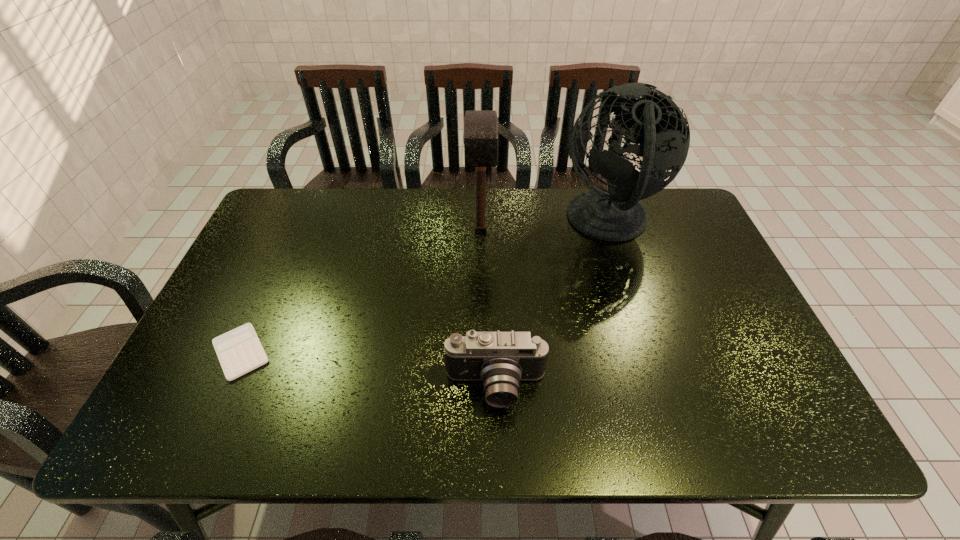
I want to click on free space between the third tallest object and the rightmost object, so click(x=552, y=305).

What are the coordinates of `vacant space that's between the leftmost object and the globe` in the screenshot? It's located at (424, 287).

Where is `vacant region between the shortest object and the camera`? This screenshot has width=960, height=540. vacant region between the shortest object and the camera is located at coordinates (369, 370).

Locate an element on the screen. This screenshot has width=960, height=540. object that stands as the second closest to the leftmost object is located at coordinates pos(480,137).

Identify which object is the second nearest to the tallest object. Please provide its 2D coordinates. Your answer should be formatted as a tuple, i.e. [(x, y)], where the tuple contains the x and y coordinates of a point satisfying the conditions above.

[(500, 360)]

I want to click on free space that satisfies the following two spatial constraints: 1. on the front-facing side of the tallest object; 2. on the front-facing side of the camera, so click(x=661, y=388).

Identify the location of vacant space that satisfies the following two spatial constraints: 1. on the front-facing side of the globe; 2. on the front-facing side of the camera. The image size is (960, 540). (661, 388).

The width and height of the screenshot is (960, 540). I want to click on free spot that satisfies the following two spatial constraints: 1. on the front-facing side of the tallest object; 2. on the front side of the mallet, so click(612, 231).

Identify the location of vacant area in the image that satisfies the following two spatial constraints: 1. on the front-facing side of the globe; 2. on the front-facing side of the second shortest object. The height and width of the screenshot is (540, 960). (661, 388).

The width and height of the screenshot is (960, 540). Identify the location of vacant position in the image that satisfies the following two spatial constraints: 1. on the front-facing side of the rightmost object; 2. on the front-facing side of the camera. (661, 388).